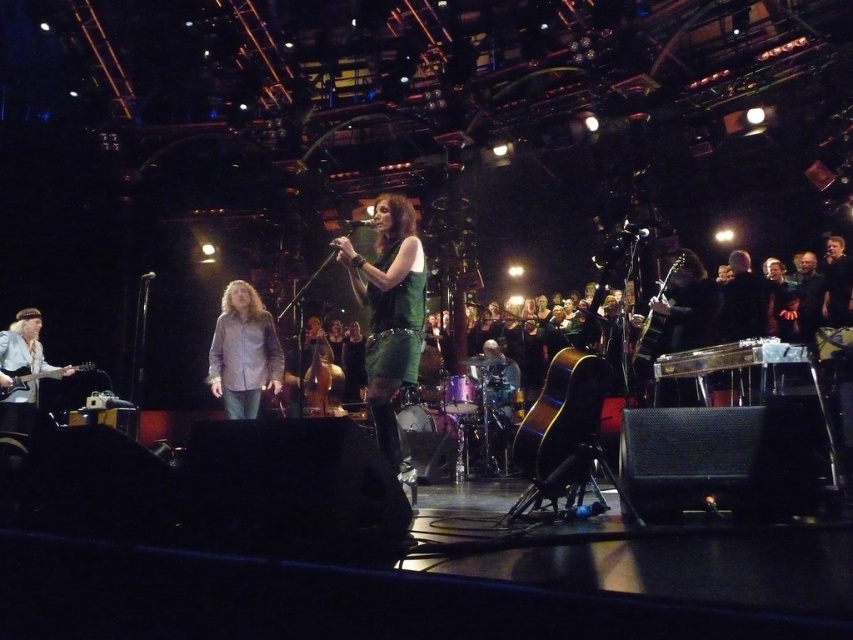
Question: Which point appears farthest from the camera in this image?

Choices:
 (A) (415, 362)
 (B) (24, 365)
 (C) (35, 320)

Answer: (C)

Question: Which point is farther to the camera?

Choices:
 (A) matte white guitar at left
 (B) shiny metallic guitar at right

Answer: (A)

Question: Is light brown shirt at center to the left of shiny metallic guitar at right from the viewer's perspective?

Choices:
 (A) no
 (B) yes

Answer: (B)

Question: Does shiny metallic guitar at right appear on the right side of matte black guitar at left?

Choices:
 (A) yes
 (B) no

Answer: (A)

Question: In this image, where is matte white guitar at left located relative to matte black guitar at left?

Choices:
 (A) above
 (B) below

Answer: (A)

Question: Which of the following is the farthest from the observer?

Choices:
 (A) (321, 358)
 (B) (375, 401)
 (C) (213, 374)
 (D) (685, 252)

Answer: (A)